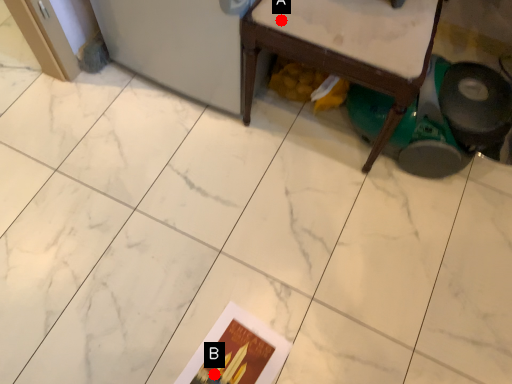
Question: Two points are circled on the image, labeled by A and B beside each circle. Which point is closer to the camera?

Choices:
 (A) A is closer
 (B) B is closer

Answer: (A)